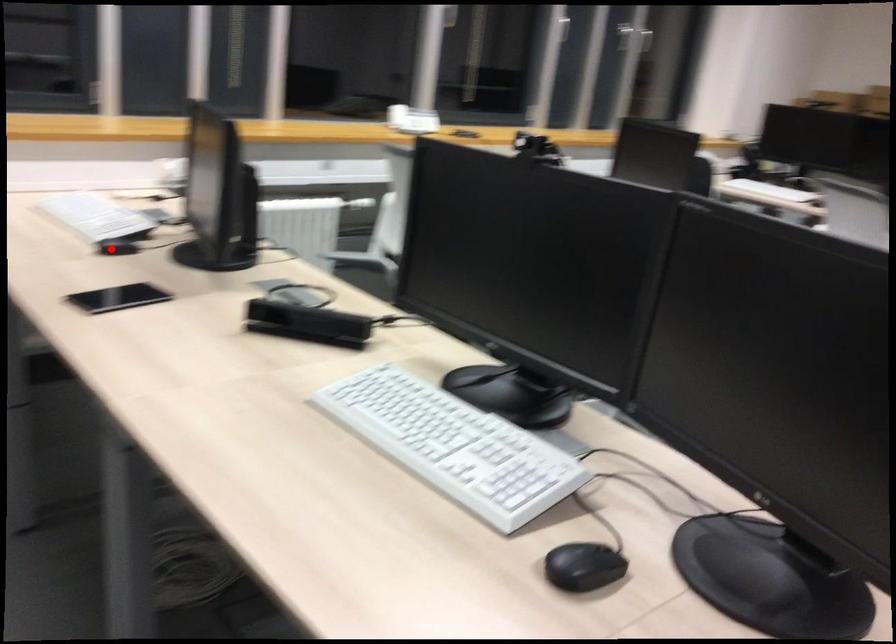
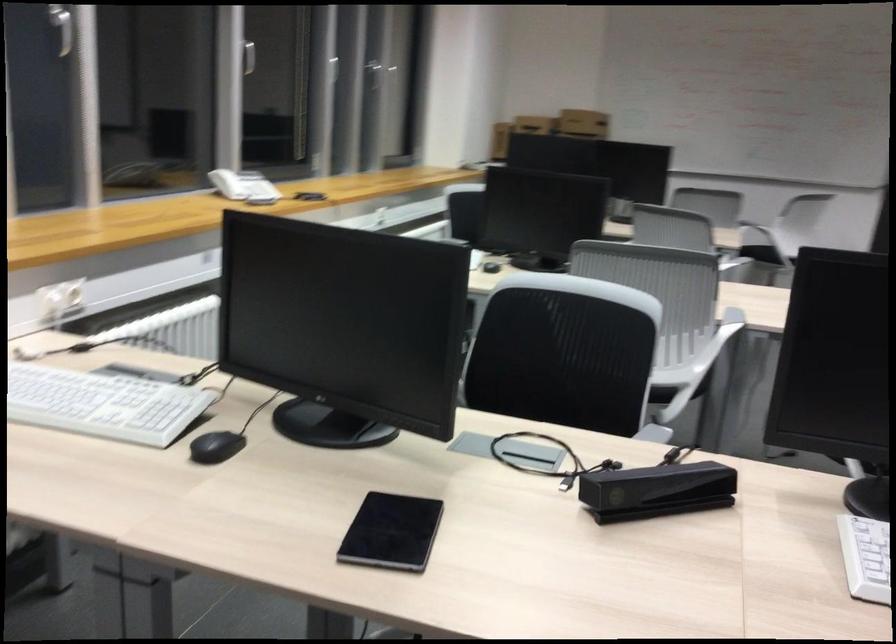
In the second image, find the point that corresponds to the highlighted location in the first image.

(216, 447)